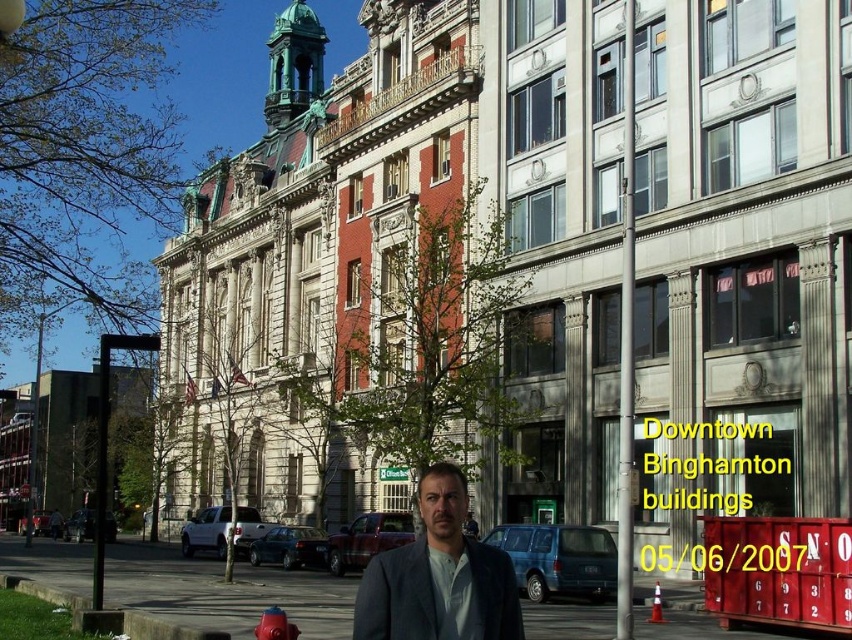
Question: Among these points, which one is nearest to the camera?

Choices:
 (A) (559, 605)
 (B) (269, 621)

Answer: (B)

Question: Is gray asphalt pavement at lower center positioned at the back of matte gray suit at center?

Choices:
 (A) yes
 (B) no

Answer: (A)

Question: Does gray asphalt pavement at lower center appear on the left side of matte gray suit at center?

Choices:
 (A) yes
 (B) no

Answer: (A)

Question: Which object is positioned closest to the matte gray suit at center?

Choices:
 (A) red matte fire hydrant at lower center
 (B) gray asphalt pavement at lower center

Answer: (A)

Question: Does matte gray suit at center appear on the left side of red matte fire hydrant at lower center?

Choices:
 (A) yes
 (B) no

Answer: (B)

Question: Which object is closer to the camera taking this photo?

Choices:
 (A) gray asphalt pavement at lower center
 (B) matte gray suit at center

Answer: (B)